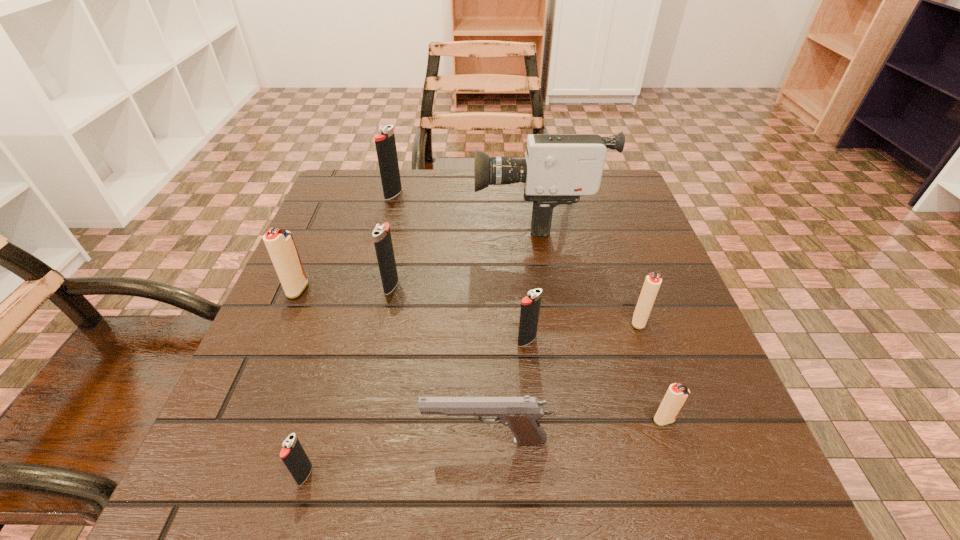
You are a GUI agent. You are given a task and a screenshot of the screen. Output one action in this format:
    pyautogui.click(x=<x>, y=<y>)
    Task: Click on the white camcorder
    
    Given the screenshot: What is the action you would take?
    pyautogui.click(x=559, y=168)

This screenshot has height=540, width=960. In order to click on camcorder in this screenshot , I will do `click(559, 168)`.

What are the coordinates of `the eighth shortest object` in the screenshot? It's located at (385, 143).

In order to click on the farthest igniter in this screenshot , I will do `click(385, 143)`.

You are a GUI agent. You are given a task and a screenshot of the screen. Output one action in this format:
    pyautogui.click(x=<x>, y=<y>)
    Task: Click on the biggest red igniter
    This screenshot has height=540, width=960.
    Given the screenshot: What is the action you would take?
    pyautogui.click(x=280, y=244)

Where is `the leftmost red igniter`? Image resolution: width=960 pixels, height=540 pixels. the leftmost red igniter is located at coordinates (280, 244).

Identify the location of the fourth igniter from left to right. (382, 239).

At what (x,y) coordinates should I click in order to perform the action: click on the third nearest black igniter. Please return your answer as a coordinate pair (x, y). This screenshot has height=540, width=960. Looking at the image, I should click on (382, 239).

The height and width of the screenshot is (540, 960). Identify the location of the fifth farthest igniter. coord(530,305).

Where is `the third farthest black igniter`? This screenshot has height=540, width=960. the third farthest black igniter is located at coordinates (530, 305).